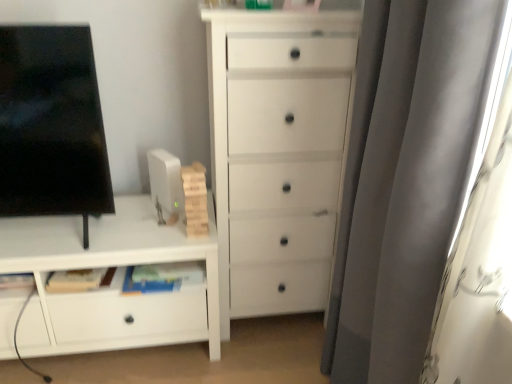
Image resolution: width=512 pixels, height=384 pixels. In order to click on free spot to the right of black glossy screen at left in this screenshot , I will do `click(141, 230)`.